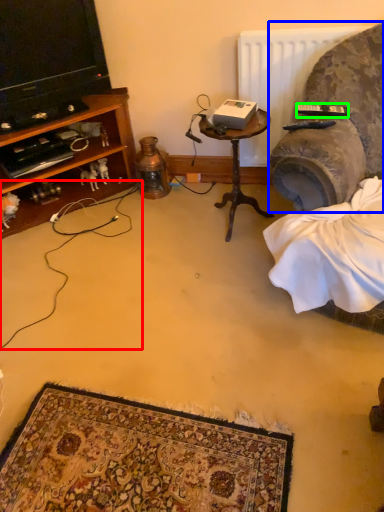
Question: Which object is the farthest from string (highlighted by a red box)? Choose among these: studio couch (highlighted by a blue box) or remote control (highlighted by a green box).

Choices:
 (A) studio couch
 (B) remote control

Answer: (B)